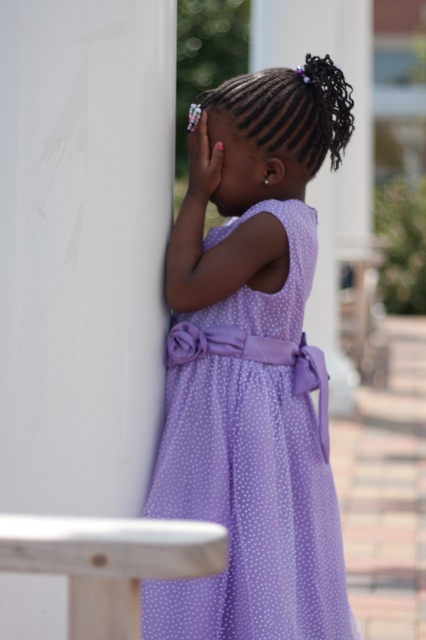
You are a photographer trying to capture the lavender polka dot dress at center while ensuring the white smooth pillar at left is visible in the frame. Based on their positions, which side of the dress should you position the pillar on?

The white smooth pillar at left is positioned to the left of the lavender polka dot dress at center, so to include it in the frame, the photographer should position the pillar on the left side of the dress.

You are designing a garden layout and need to place a statue that is 1.5 meters wide. The statue must be placed between the white smooth pillar at left and the lavender polka dot dress at center. Based on the scene description, will the statue fit between them?

The white smooth pillar at left is smaller than the lavender polka dot dress at center, but the exact distance between them isn